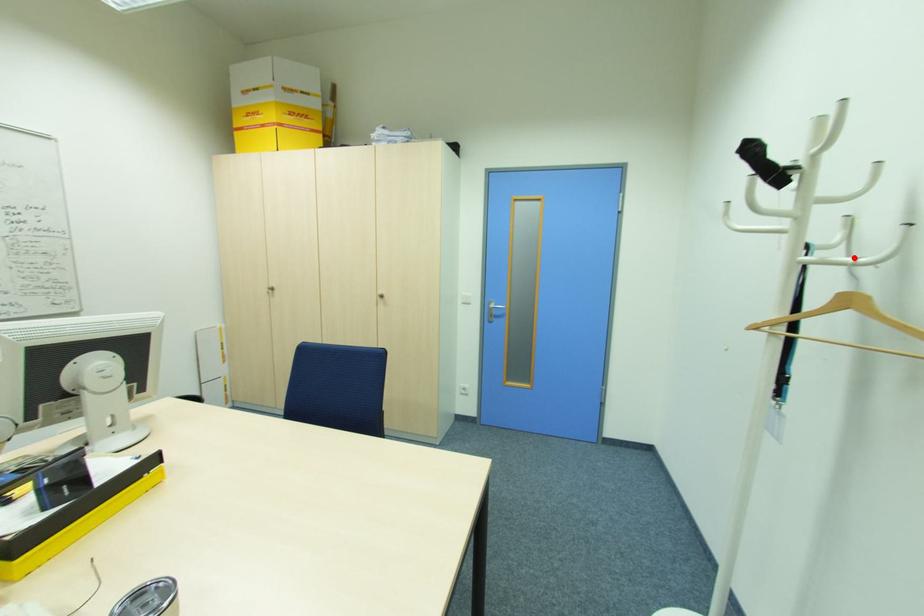
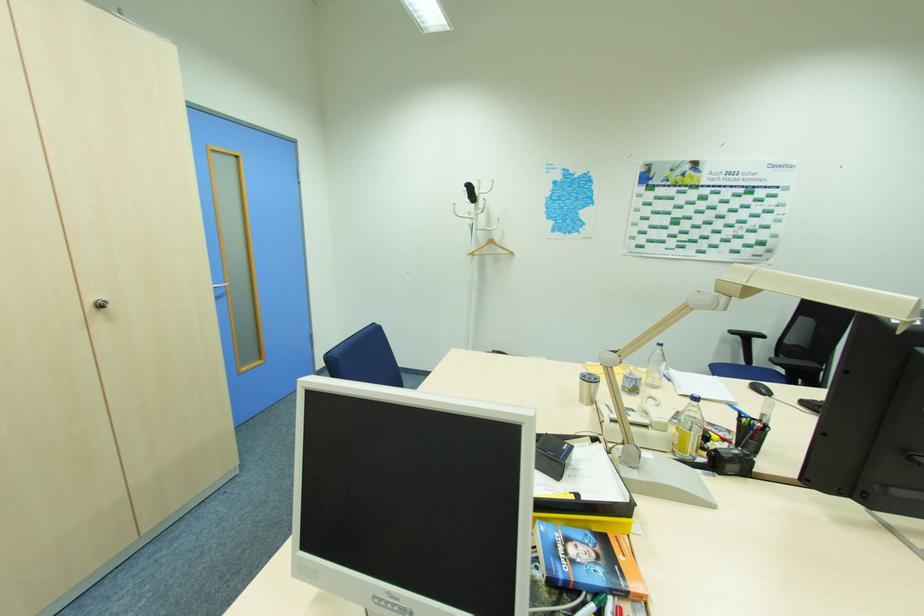
Find the pixel in the second image that matches the highlighted location in the first image.

(492, 229)